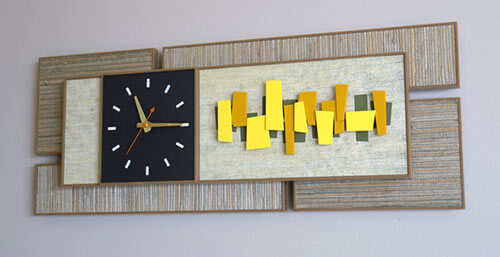
You are a GUI agent. You are given a task and a screenshot of the screen. Output one action in this format:
    pyautogui.click(x=<x>, y=<y>)
    Task: Click on the tan wood
    
    Given the screenshot: What is the action you would take?
    click(326, 161)